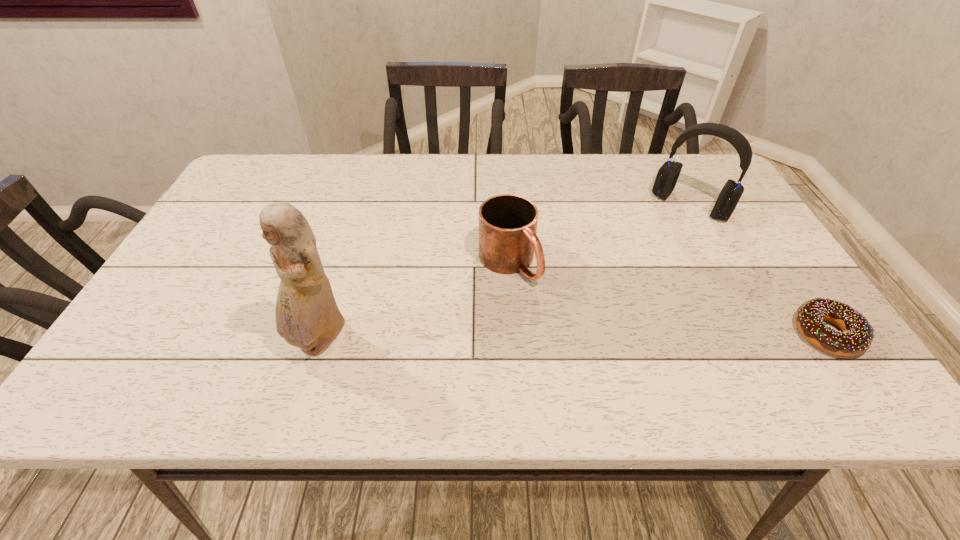
Where is `object that is at the near right corner`? This screenshot has width=960, height=540. object that is at the near right corner is located at coordinates pyautogui.click(x=857, y=337).

Where is `free space at the far edge`? This screenshot has width=960, height=540. free space at the far edge is located at coordinates (540, 163).

Where is `vacant position at the near edge of the desktop`? vacant position at the near edge of the desktop is located at coordinates (396, 357).

Find the location of a particular element. Image resolution: width=960 pixels, height=540 pixels. vacant space at the far left corner of the desktop is located at coordinates pyautogui.click(x=252, y=189).

Identify the location of vacant space at the near right corner of the desktop. The height and width of the screenshot is (540, 960). (802, 360).

I want to click on free space that is in between the figurine and the mug, so click(x=415, y=302).

The width and height of the screenshot is (960, 540). Identify the location of free space between the third nearest object and the shortest object. click(x=668, y=298).

The width and height of the screenshot is (960, 540). I want to click on free spot between the mug and the farthest object, so click(599, 234).

Where is `empty space that is in between the figurine and the doughnut`? The width and height of the screenshot is (960, 540). empty space that is in between the figurine and the doughnut is located at coordinates (574, 338).

This screenshot has width=960, height=540. In order to click on vacant area that lies between the shortest object and the leftmost object in this screenshot , I will do `click(574, 338)`.